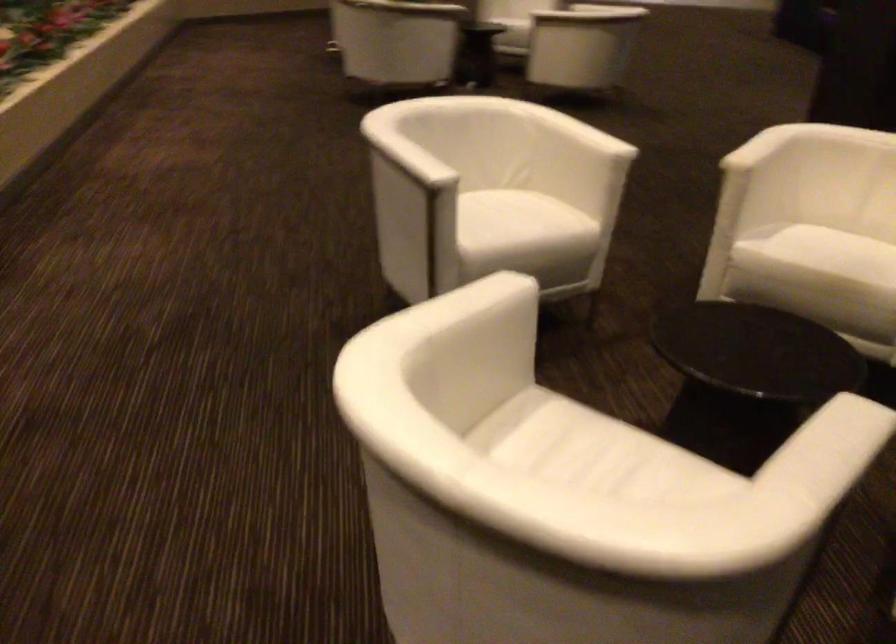
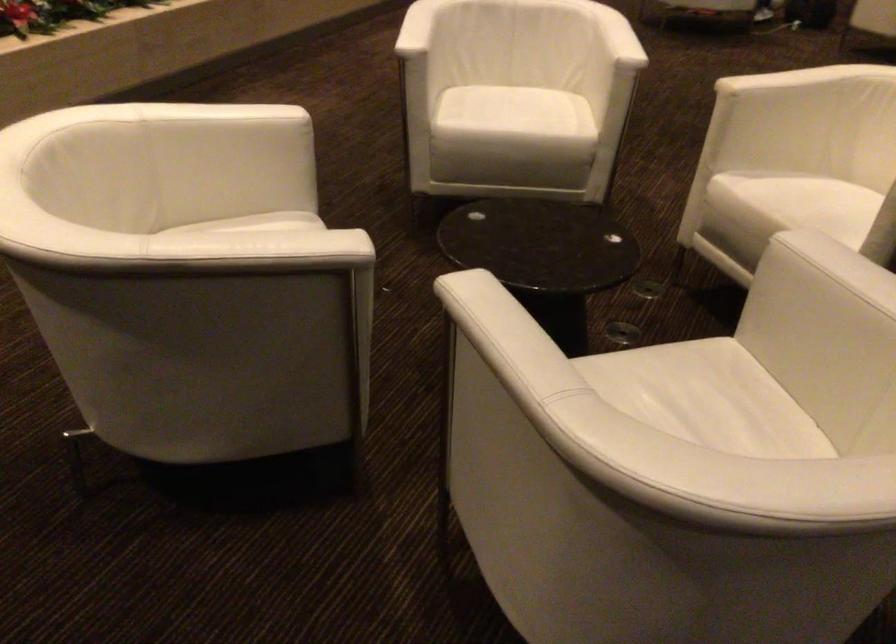
Find the pixel in the second image that matches point 782,147 in the first image.

(789, 80)